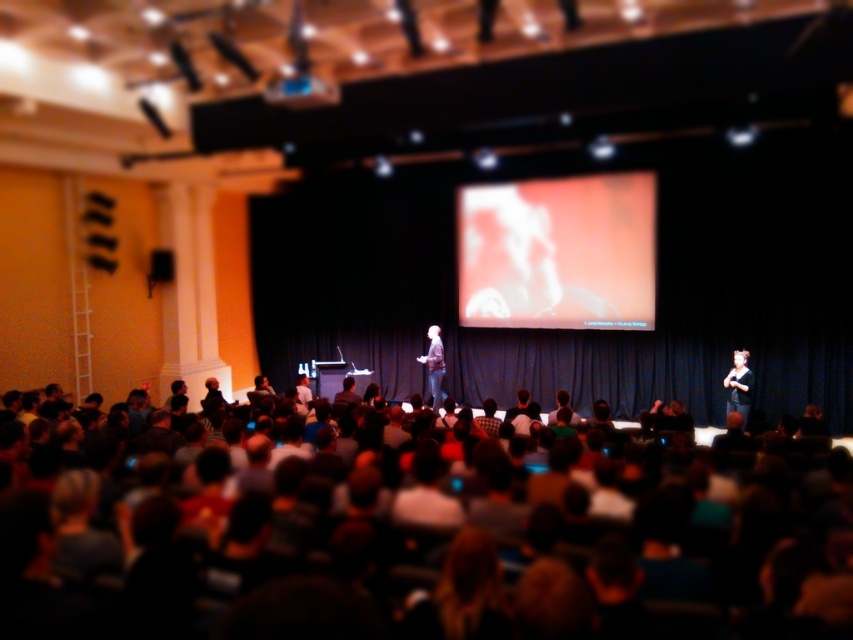
You are sitting in the front row of the auditorium and want to hand the presenter a note. You see the blue plastic projector at upper center and the dark gray jacket at center. Which object is closer to you?

The blue plastic projector at upper center is closer to you than the dark gray jacket at center.

You are an event organizer who needs to adjust the stage setup. You want to ensure that the blue plastic projector at upper center is visible to the audience. Considering the dark gray jacket at center, which object is shorter and thus less likely to block the projector?

The blue plastic projector at upper center is shorter than the dark gray jacket at center, so it is less likely to block the projector.